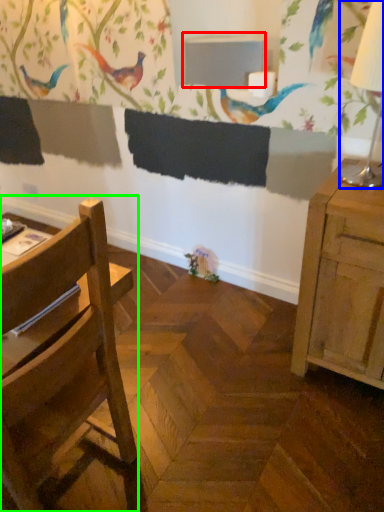
Question: Which object is the closest to the table (highlighted by a red box)? Choose among these: table lamp (highlighted by a blue box) or chair (highlighted by a green box).

Choices:
 (A) table lamp
 (B) chair

Answer: (A)